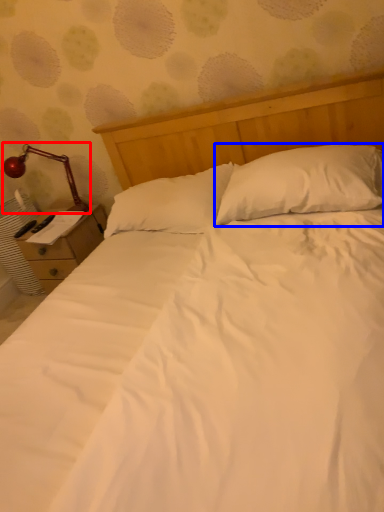
Question: Which object is closer to the camera taking this photo, lamp (highlighted by a red box) or pillow (highlighted by a blue box)?

Choices:
 (A) lamp
 (B) pillow

Answer: (B)